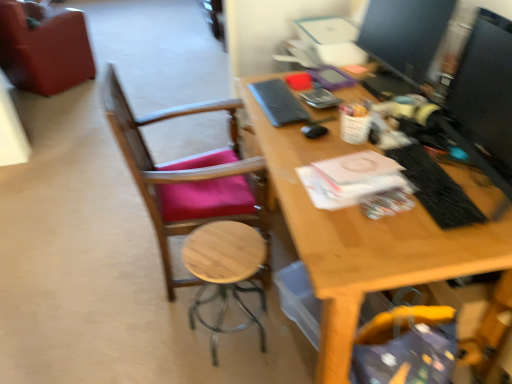
Question: Does matte black monitor at upper right have a greater width compared to black textured laptop keyboard at right?

Choices:
 (A) no
 (B) yes

Answer: (B)

Question: From a real-world perspective, is matte black monitor at upper right beneath black textured laptop keyboard at right?

Choices:
 (A) yes
 (B) no

Answer: (B)

Question: From the image's perspective, would you say matte black monitor at upper right is positioned over black textured laptop keyboard at right?

Choices:
 (A) no
 (B) yes

Answer: (B)

Question: Considering the relative positions of matte black monitor at upper right and black textured laptop keyboard at right in the image provided, is matte black monitor at upper right to the left of black textured laptop keyboard at right from the viewer's perspective?

Choices:
 (A) yes
 (B) no

Answer: (B)

Question: Does matte black monitor at upper right have a lesser width compared to black textured laptop keyboard at right?

Choices:
 (A) no
 (B) yes

Answer: (A)

Question: Is matte black monitor at upper right smaller than black textured laptop keyboard at right?

Choices:
 (A) no
 (B) yes

Answer: (A)

Question: From the image's perspective, does velvet-like red chair at upper left, arranged as the first chair when viewed from the back, appear lower than wooden stool at center?

Choices:
 (A) no
 (B) yes

Answer: (A)

Question: Is wooden stool at center located within velvet-like red chair at upper left, which is the 2th chair in bottom-to-top order?

Choices:
 (A) yes
 (B) no

Answer: (B)

Question: Are velvet-like red chair at upper left, arranged as the first chair when viewed from the back, and wooden stool at center located far from each other?

Choices:
 (A) yes
 (B) no

Answer: (A)

Question: Considering the relative sizes of velvet-like red chair at upper left, marked as the 1th chair in a left-to-right arrangement, and wooden stool at center in the image provided, is velvet-like red chair at upper left, marked as the 1th chair in a left-to-right arrangement, wider than wooden stool at center?

Choices:
 (A) no
 (B) yes

Answer: (B)

Question: Does velvet-like red chair at upper left, which is counted as the 2th chair, starting from the right, have a greater height compared to wooden stool at center?

Choices:
 (A) no
 (B) yes

Answer: (B)

Question: Does velvet-like red chair at upper left, marked as the 1th chair in a left-to-right arrangement, turn towards wooden stool at center?

Choices:
 (A) yes
 (B) no

Answer: (B)

Question: Does black textured laptop keyboard at right appear on the right side of matte black monitor at upper right?

Choices:
 (A) yes
 (B) no

Answer: (B)